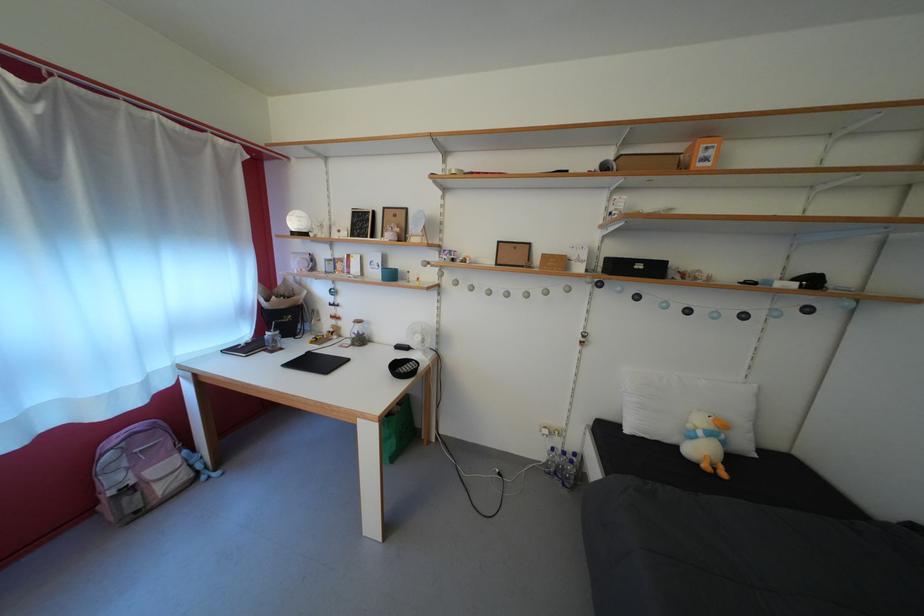
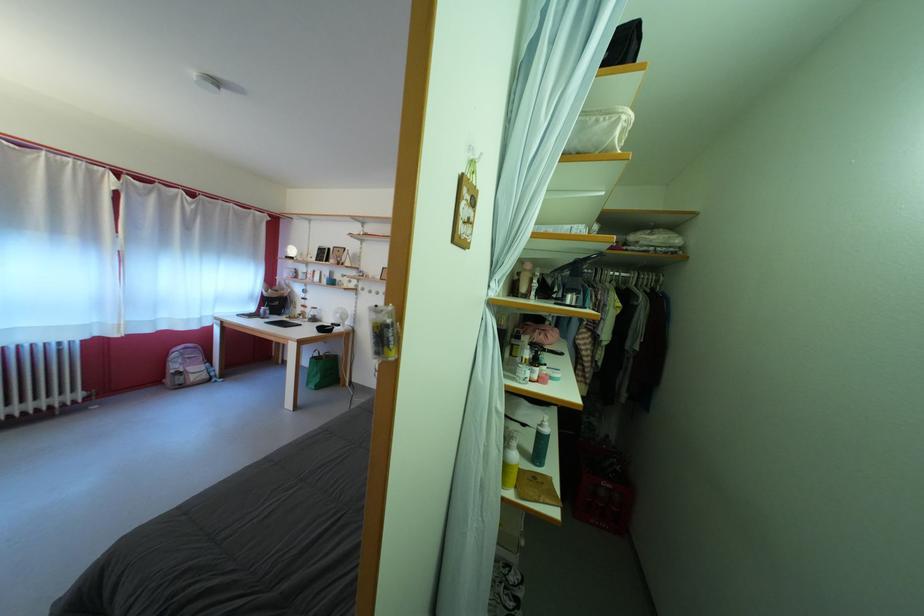
The point at (x=123, y=485) is marked in the first image. Where is the corresponding point in the second image?

(184, 373)